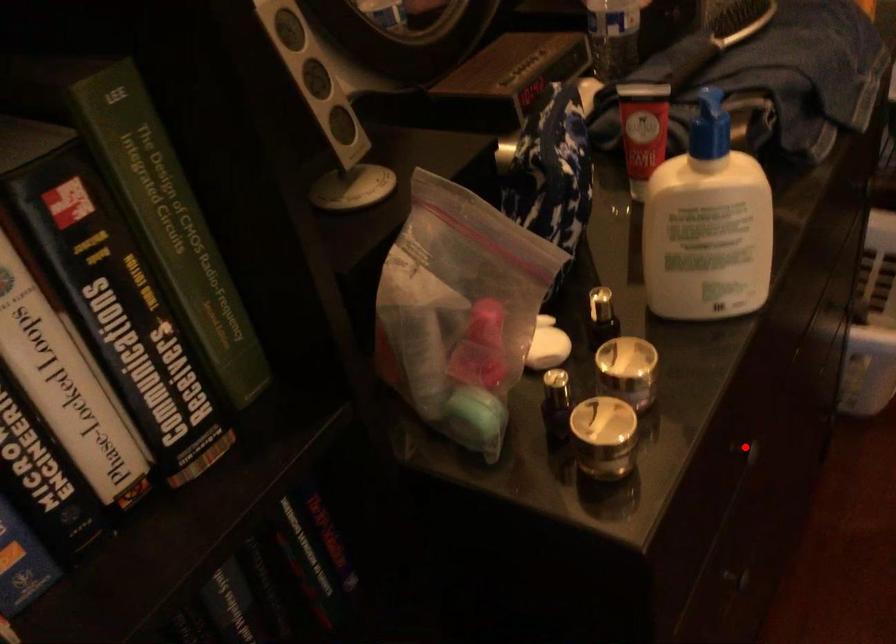
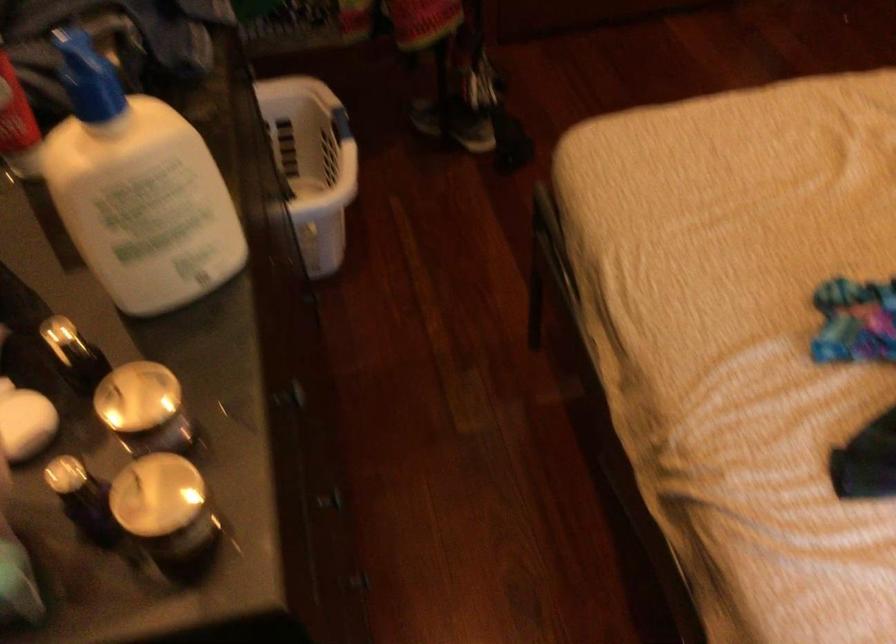
Where in the second image is the point corresponding to the highlighted location from the first image?

(295, 393)